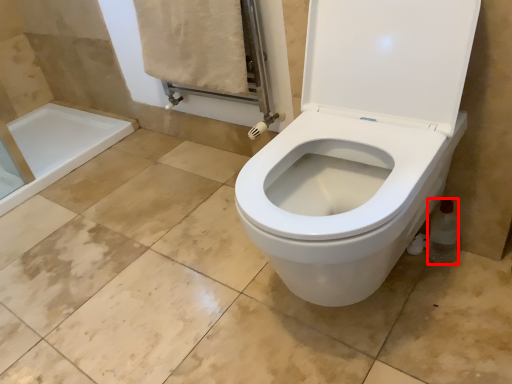
Question: From the image's perspective, what is the correct spatial positioning of bottle (annotated by the red box) in reference to bath towel?

Choices:
 (A) above
 (B) below

Answer: (B)